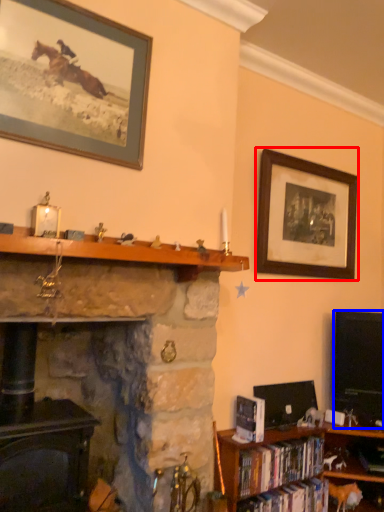
Question: Which object is closer to the camera taking this photo, picture frame (highlighted by a red box) or television (highlighted by a blue box)?

Choices:
 (A) picture frame
 (B) television

Answer: (A)